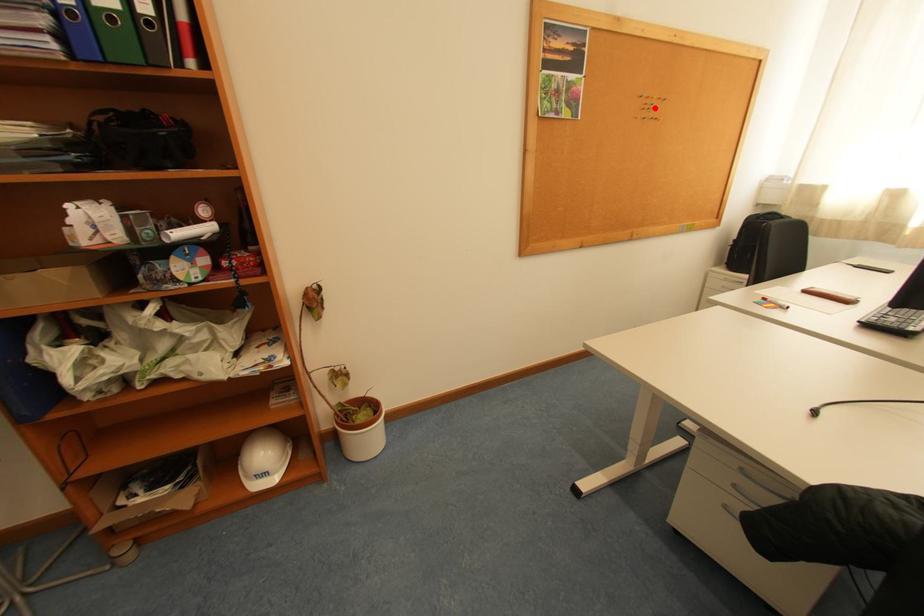
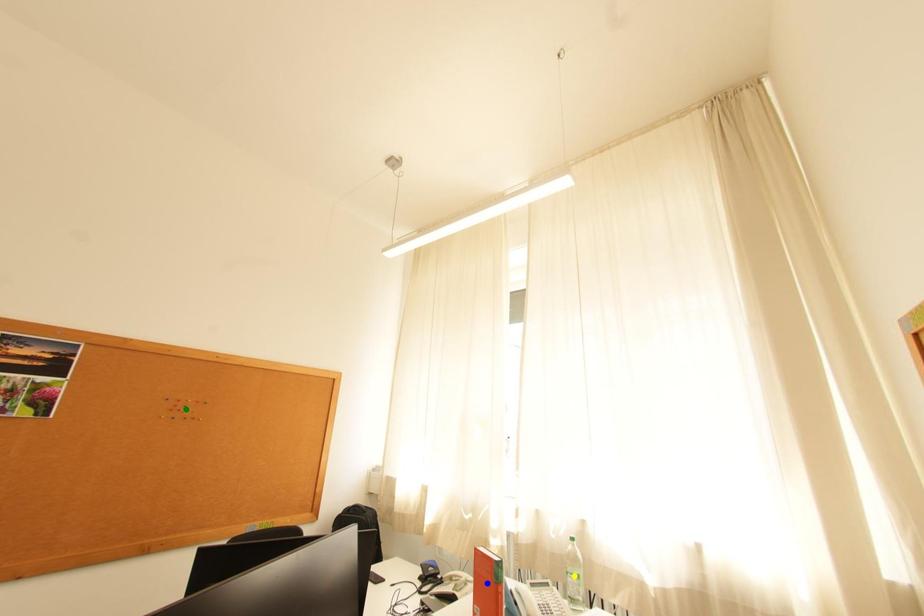
Question: I am providing you with two images of the same scene from different viewpoints. A red point is marked on the first image. You are given multiple points on the second image. Which point in image 2 is actually the same real-world point as the red point in image 1?

Choices:
 (A) blue point
 (B) green point
 (C) yellow point

Answer: (B)